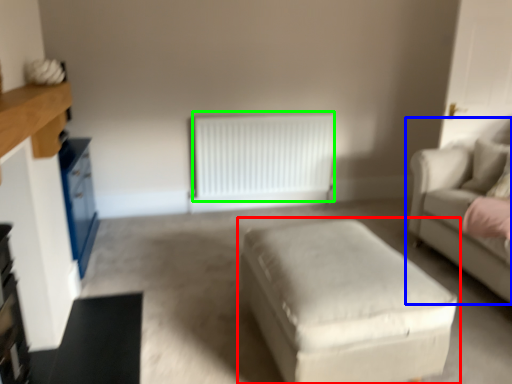
Question: Which is nearer to the table (highlighted by a red box)? studio couch (highlighted by a blue box) or radiator (highlighted by a green box).

Choices:
 (A) studio couch
 (B) radiator

Answer: (A)